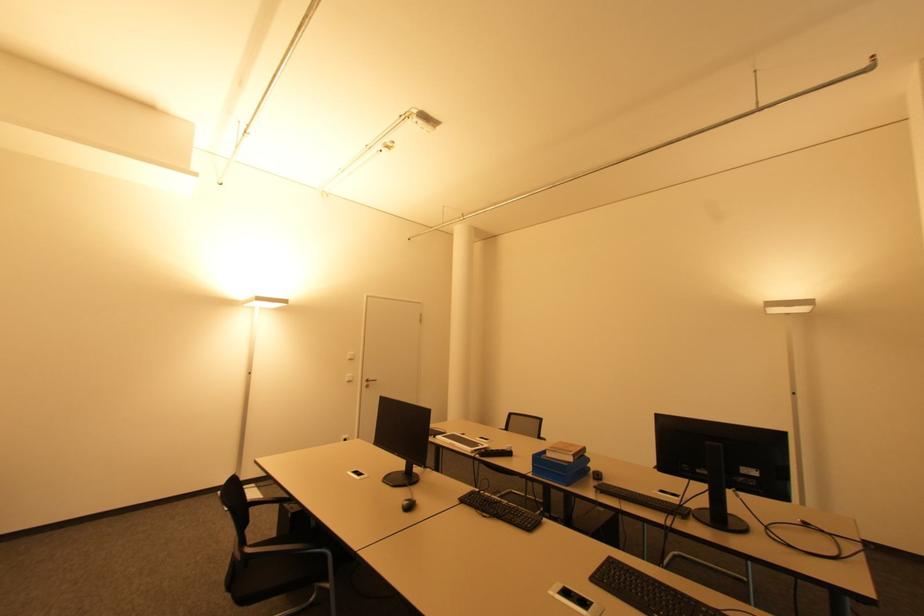
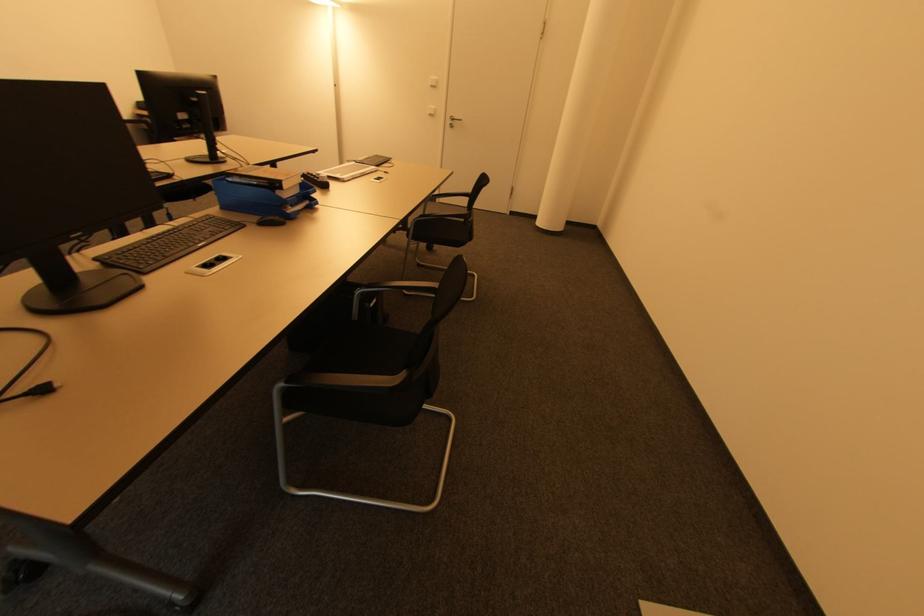
The point at (351, 360) is marked in the first image. Where is the corresponding point in the second image?

(434, 87)